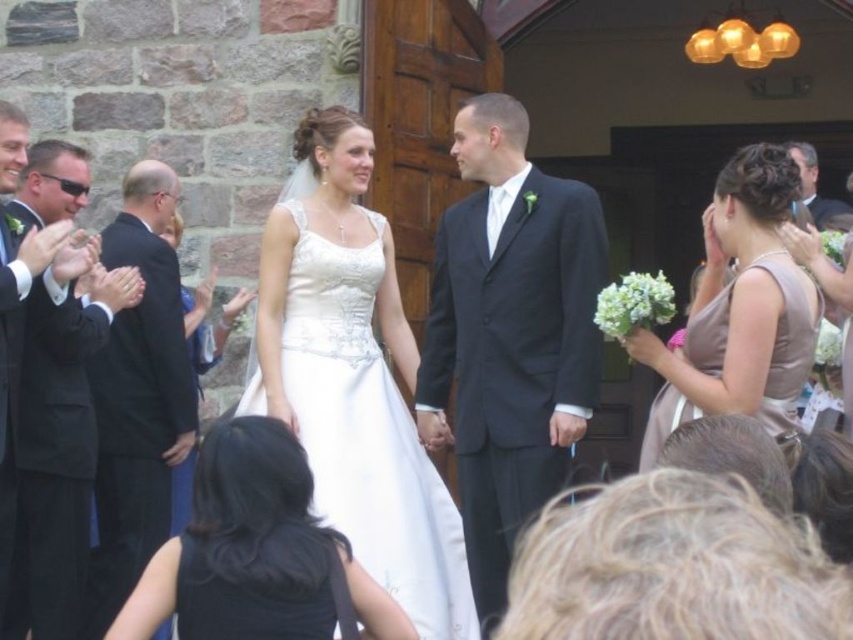
Question: Which point appears farthest from the camera in this image?

Choices:
 (A) (775, 433)
 (B) (6, 621)
 (C) (137, 563)

Answer: (C)

Question: Does matte black suit at center have a smaller size compared to black satin suit at left?

Choices:
 (A) yes
 (B) no

Answer: (A)

Question: Which object is farther from the camera taking this photo?

Choices:
 (A) black satin suit at left
 (B) satin beige dress at right
 (C) black suit at left

Answer: (C)

Question: In this image, where is white satin dress at center located relative to black suit at left?

Choices:
 (A) left
 (B) right

Answer: (B)

Question: Is satin beige dress at right behind black satin suit at left?

Choices:
 (A) no
 (B) yes

Answer: (A)

Question: Which point appears closest to the camera in this image?

Choices:
 (A) (292, 323)
 (B) (151, 621)

Answer: (B)